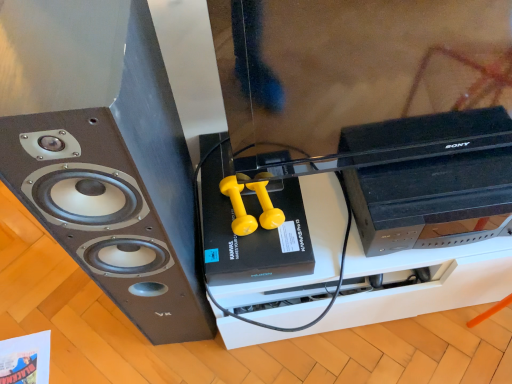
This screenshot has height=384, width=512. I want to click on vacant space that is to the left of black matte speaker at left, so click(90, 326).